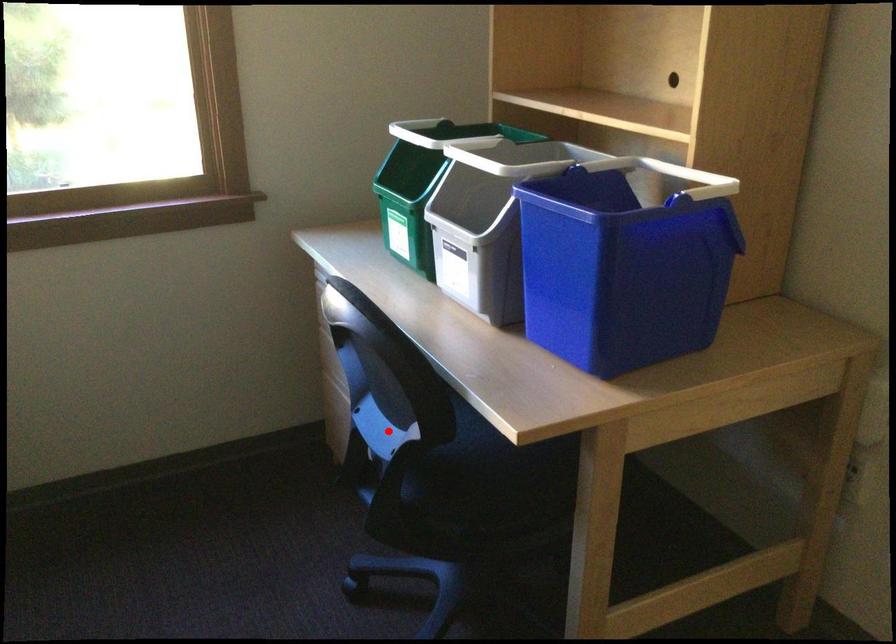
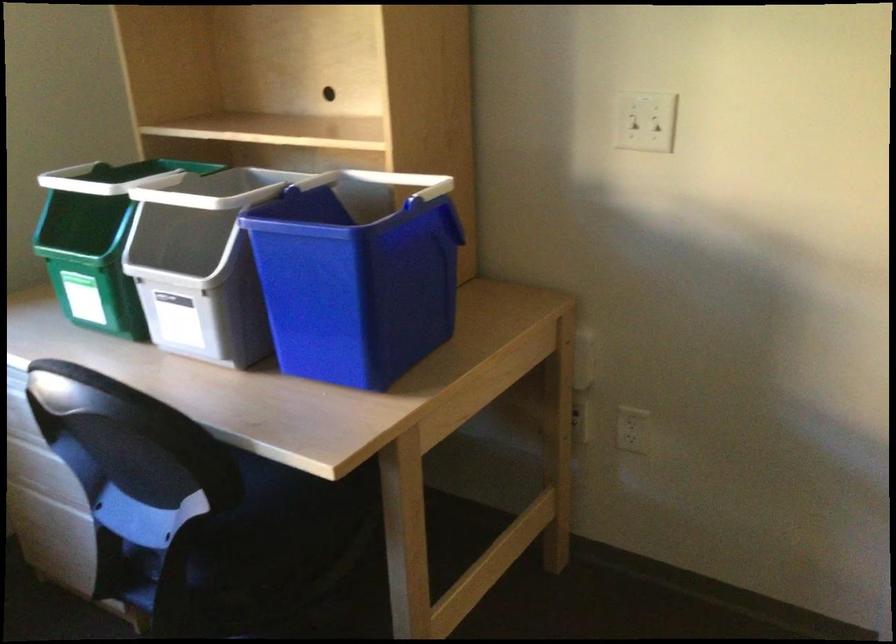
Question: I am providing you with two images of the same scene from different viewpoints. Given a red point in image1, look at the same physical point in image2. Is it:

Choices:
 (A) Closer to the viewpoint
 (B) Farther from the viewpoint

Answer: (A)